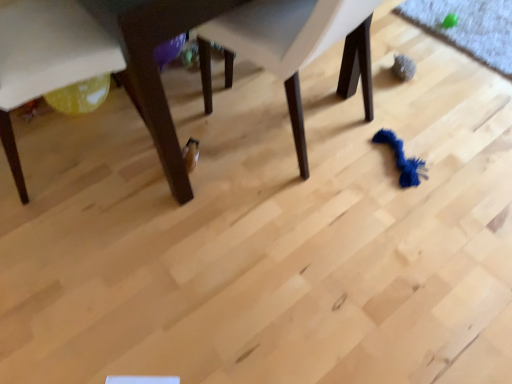
What do you see at coordinates (294, 48) in the screenshot? This screenshot has width=512, height=384. I see `white plastic chair at center, marked as the 2th chair in a left-to-right arrangement` at bounding box center [294, 48].

What do you see at coordinates (96, 60) in the screenshot? The image size is (512, 384). I see `wooden table at center` at bounding box center [96, 60].

Image resolution: width=512 pixels, height=384 pixels. Identify the location of white plastic chair at center, marked as the 2th chair in a left-to-right arrangement. (294, 48).

Between white plastic chair at center, marked as the 2th chair in a left-to-right arrangement, and wooden table at center, which one has smaller width?

white plastic chair at center, marked as the 2th chair in a left-to-right arrangement.

Which point is more distant from viewer, (236,23) or (56,62)?

The point (236,23) is behind.

From the image's perspective, which object appears higher, white plastic chair at center, positioned as the 1th chair in right-to-left order, or wooden table at center?

wooden table at center.

Is white plastic chair at center, marked as the 2th chair in a left-to-right arrangement, looking in the opposite direction of wooden table at center?

Yes, wooden table at center is at the back of white plastic chair at center, marked as the 2th chair in a left-to-right arrangement.

Looking at the image, does wooden table at center seem bigger or smaller compared to white plastic chair at center, marked as the 2th chair in a left-to-right arrangement?

Considering their sizes, wooden table at center takes up more space than white plastic chair at center, marked as the 2th chair in a left-to-right arrangement.

In terms of width, does wooden table at center look wider or thinner when compared to white plastic chair at center, positioned as the 1th chair in right-to-left order?

Clearly, wooden table at center has more width compared to white plastic chair at center, positioned as the 1th chair in right-to-left order.

Which is further, (103, 62) or (245, 50)?

The point (245, 50) is farther from the camera.

Locate an element on the screen. This screenshot has height=384, width=512. the 1st chair behind the wooden table at center, starting your count from the anchor is located at coordinates (294, 48).

Could you measure the distance between wooden table at center and matte white chair at lower left, acting as the second chair starting from the right?

wooden table at center and matte white chair at lower left, acting as the second chair starting from the right, are 3.32 inches apart.

From the image's perspective, is wooden table at center above matte white chair at lower left, acting as the second chair starting from the right?

Yes.

From a real-world perspective, is wooden table at center positioned under matte white chair at lower left, placed as the first chair when sorted from left to right, based on gravity?

No.

Which is more to the left, matte white chair at lower left, acting as the second chair starting from the right, or wooden table at center?

Positioned to the left is matte white chair at lower left, acting as the second chair starting from the right.

Does matte white chair at lower left, placed as the first chair when sorted from left to right, have a greater height compared to wooden table at center?

In fact, matte white chair at lower left, placed as the first chair when sorted from left to right, may be shorter than wooden table at center.

Find the location of a particular element. Image resolution: width=512 pixels, height=384 pixels. table located on the right of matte white chair at lower left, acting as the second chair starting from the right is located at coordinates (96, 60).

In the scene shown: Which point is more distant from viewer, (122, 63) or (207, 44)?

Point (207, 44)

Is matte white chair at lower left, placed as the first chair when sorted from left to right, looking in the opposite direction of white plastic chair at center, marked as the 2th chair in a left-to-right arrangement?

No, matte white chair at lower left, placed as the first chair when sorted from left to right,'s orientation is not away from white plastic chair at center, marked as the 2th chair in a left-to-right arrangement.

Which is in front, matte white chair at lower left, placed as the first chair when sorted from left to right, or white plastic chair at center, marked as the 2th chair in a left-to-right arrangement?

white plastic chair at center, marked as the 2th chair in a left-to-right arrangement, is closer to the camera.

Can you confirm if white plastic chair at center, positioned as the 1th chair in right-to-left order, is bigger than matte white chair at lower left, placed as the first chair when sorted from left to right?

Indeed, white plastic chair at center, positioned as the 1th chair in right-to-left order, has a larger size compared to matte white chair at lower left, placed as the first chair when sorted from left to right.

Considering the positions of objects white plastic chair at center, positioned as the 1th chair in right-to-left order, and matte white chair at lower left, placed as the first chair when sorted from left to right, in the image provided, who is more to the left, white plastic chair at center, positioned as the 1th chair in right-to-left order, or matte white chair at lower left, placed as the first chair when sorted from left to right,?

From the viewer's perspective, matte white chair at lower left, placed as the first chair when sorted from left to right, appears more on the left side.

From the image's perspective, which one is positioned lower, white plastic chair at center, marked as the 2th chair in a left-to-right arrangement, or matte white chair at lower left, placed as the first chair when sorted from left to right?

matte white chair at lower left, placed as the first chair when sorted from left to right.

Consider the image. Is white plastic chair at center, positioned as the 1th chair in right-to-left order, in contact with matte white chair at lower left, acting as the second chair starting from the right?

white plastic chair at center, positioned as the 1th chair in right-to-left order, and matte white chair at lower left, acting as the second chair starting from the right, are not in contact.

Locate an element on the screen. The height and width of the screenshot is (384, 512). chair that is the 1st one when counting backward from the wooden table at center is located at coordinates (294, 48).

Where is `table in front of the white plastic chair at center, positioned as the 1th chair in right-to-left order`? This screenshot has width=512, height=384. table in front of the white plastic chair at center, positioned as the 1th chair in right-to-left order is located at coordinates (96, 60).

Looking at the image, which one is located closer to matte white chair at lower left, placed as the first chair when sorted from left to right, wooden table at center or white plastic chair at center, positioned as the 1th chair in right-to-left order?

wooden table at center is positioned closer to the anchor matte white chair at lower left, placed as the first chair when sorted from left to right.

Which object lies further to the anchor point white plastic chair at center, marked as the 2th chair in a left-to-right arrangement, wooden table at center or matte white chair at lower left, acting as the second chair starting from the right?

The object further to white plastic chair at center, marked as the 2th chair in a left-to-right arrangement, is matte white chair at lower left, acting as the second chair starting from the right.

When comparing their distances from wooden table at center, does matte white chair at lower left, placed as the first chair when sorted from left to right, or white plastic chair at center, marked as the 2th chair in a left-to-right arrangement, seem further?

Among the two, white plastic chair at center, marked as the 2th chair in a left-to-right arrangement, is located further to wooden table at center.

From the image, which object appears to be farther from white plastic chair at center, positioned as the 1th chair in right-to-left order, matte white chair at lower left, placed as the first chair when sorted from left to right, or wooden table at center?

Among the two, matte white chair at lower left, placed as the first chair when sorted from left to right, is located further to white plastic chair at center, positioned as the 1th chair in right-to-left order.

Estimate the real-world distances between objects in this image. Which object is further from wooden table at center, white plastic chair at center, marked as the 2th chair in a left-to-right arrangement, or matte white chair at lower left, acting as the second chair starting from the right?

white plastic chair at center, marked as the 2th chair in a left-to-right arrangement, is further to wooden table at center.

Considering their positions, is white plastic chair at center, marked as the 2th chair in a left-to-right arrangement, positioned closer to matte white chair at lower left, placed as the first chair when sorted from left to right, than wooden table at center?

wooden table at center is positioned closer to the anchor matte white chair at lower left, placed as the first chair when sorted from left to right.

Locate an element on the screen. Image resolution: width=512 pixels, height=384 pixels. table located between matte white chair at lower left, acting as the second chair starting from the right, and white plastic chair at center, marked as the 2th chair in a left-to-right arrangement, in the left-right direction is located at coordinates click(x=96, y=60).